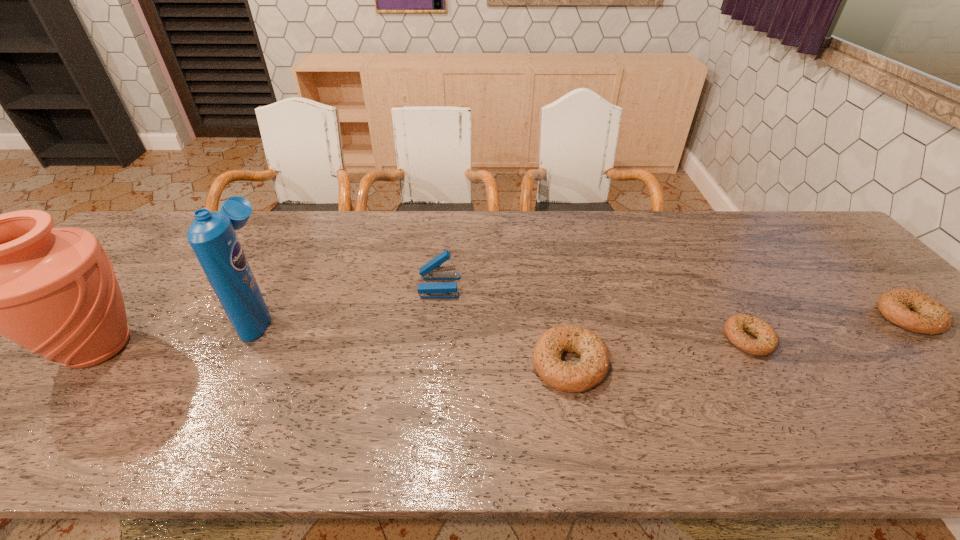
Please point out where to position a new bagel on the left to maintain spacing. Please provide its 2D coordinates. Your answer should be formatted as a tuple, i.e. [(x, y)], where the tuple contains the x and y coordinates of a point satisfying the conditions above.

[(371, 391)]